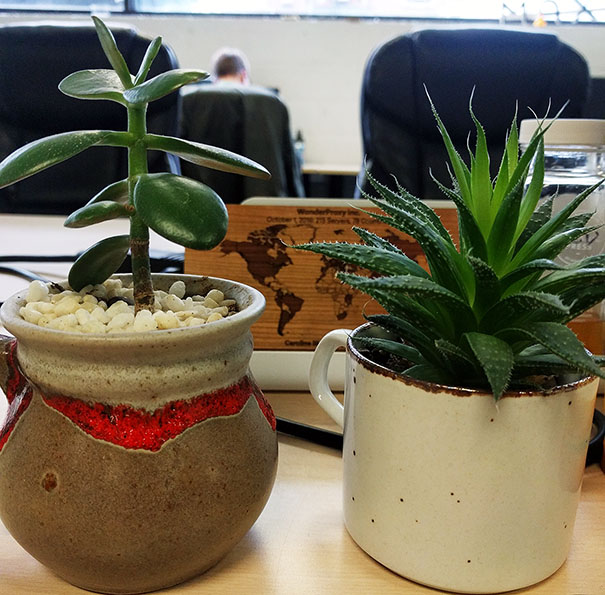
You are a GUI agent. You are given a task and a screenshot of the screen. Output one action in this format:
    pyautogui.click(x=<x>, y=<y>)
    Task: Click on the table
    This screenshot has height=595, width=605.
    Given the screenshot: What is the action you would take?
    pyautogui.click(x=286, y=516)